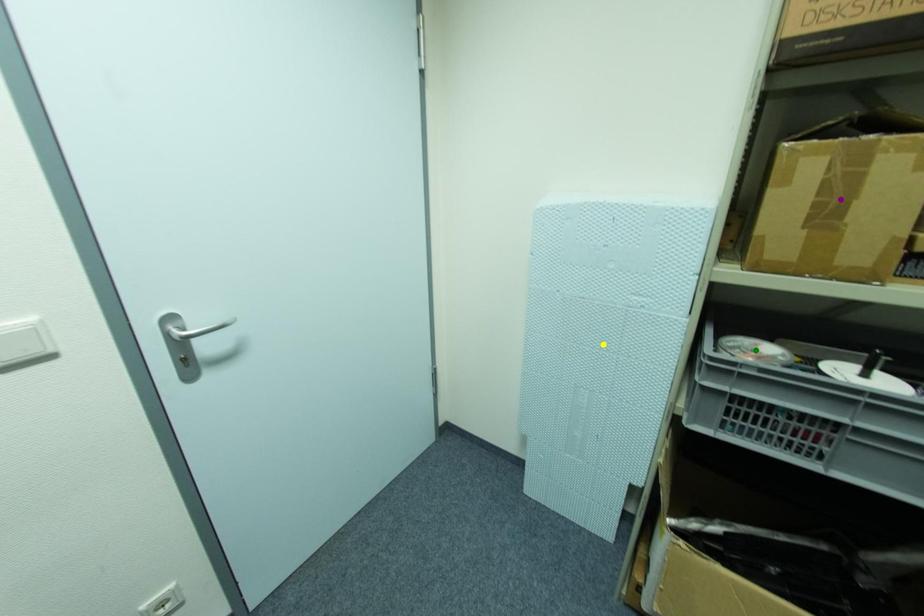
From the picture: Order these from nearest to farthest:
purple point
yellow point
green point

yellow point → green point → purple point